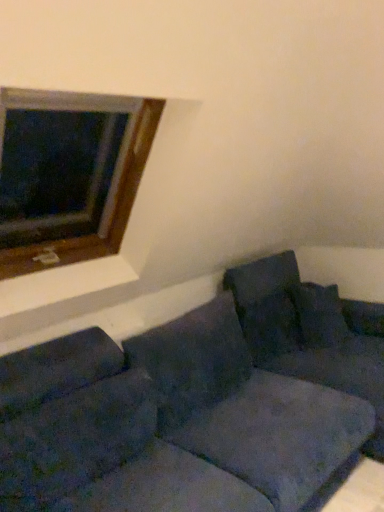
Find the location of a particular element. velvet blue couch at lower right is located at coordinates (190, 409).

This screenshot has height=512, width=384. What do you see at coordinates (266, 304) in the screenshot?
I see `velvety dark blue pillow at center, the second pillow from the right` at bounding box center [266, 304].

Where is `velvety dark blue pillow at center, the third pillow from the right`? velvety dark blue pillow at center, the third pillow from the right is located at coordinates (192, 359).

Is velvet blue couch at lower right at the back of velvety dark blue pillow at center, the first pillow viewed from the left?

Yes, velvety dark blue pillow at center, the first pillow viewed from the left, is facing away from velvet blue couch at lower right.

Who is shorter, velvety dark blue pillow at center, the third pillow from the right, or velvet blue couch at lower right?

velvety dark blue pillow at center, the third pillow from the right.

Measure the distance from velvety dark blue pillow at center, the first pillow viewed from the left, to velvet blue couch at lower right.

velvety dark blue pillow at center, the first pillow viewed from the left, is 6.63 inches from velvet blue couch at lower right.

Considering the positions of objects velvet dark blue pillow at right, which is the 3th pillow from left to right, and wooden frame at upper left in the image provided, who is behind, velvet dark blue pillow at right, which is the 3th pillow from left to right, or wooden frame at upper left?

velvet dark blue pillow at right, which is the 3th pillow from left to right, is behind.

Is point (304, 306) less distant than point (113, 247)?

No, it is behind (113, 247).

From the image's perspective, between velvet dark blue pillow at right, which is the 3th pillow from left to right, and wooden frame at upper left, which one is located above?

wooden frame at upper left is shown above in the image.

From a real-world perspective, between velvet dark blue pillow at right, which ranks as the first pillow in right-to-left order, and wooden frame at upper left, who is vertically lower?

velvet dark blue pillow at right, which ranks as the first pillow in right-to-left order, is physically lower.

Which object is further away from the camera, velvety dark blue pillow at center, the 2th pillow viewed from the left, or velvet blue couch at lower right?

velvety dark blue pillow at center, the 2th pillow viewed from the left, is further away from the camera.

Could you tell me if velvety dark blue pillow at center, the second pillow from the right, is facing velvet blue couch at lower right?

No, velvety dark blue pillow at center, the second pillow from the right, does not turn towards velvet blue couch at lower right.

Does point (287, 279) lie behind point (87, 465)?

Yes, point (287, 279) is behind point (87, 465).

Identify the location of the 2nd pillow behind the velvet blue couch at lower right. This screenshot has width=384, height=512. (266, 304).

From the image's perspective, who appears lower, velvet blue couch at lower right or velvety dark blue pillow at center, the third pillow from the right?

velvet blue couch at lower right appears lower in the image.

Is velvet blue couch at lower right next to velvety dark blue pillow at center, the third pillow from the right, and touching it?

No, velvet blue couch at lower right is not beside velvety dark blue pillow at center, the third pillow from the right.

Is velvet blue couch at lower right positioned beyond the bounds of velvety dark blue pillow at center, the third pillow from the right?

velvet blue couch at lower right is positioned outside velvety dark blue pillow at center, the third pillow from the right.

Looking at their sizes, would you say velvet blue couch at lower right is wider or thinner than velvety dark blue pillow at center, the first pillow viewed from the left?

In the image, velvet blue couch at lower right appears to be wider than velvety dark blue pillow at center, the first pillow viewed from the left.

Considering the positions of objects wooden frame at upper left and velvety dark blue pillow at center, the second pillow from the right, in the image provided, who is more to the left, wooden frame at upper left or velvety dark blue pillow at center, the second pillow from the right,?

wooden frame at upper left.

From a real-world perspective, is wooden frame at upper left physically located above or below velvety dark blue pillow at center, the second pillow from the right?

From a real-world perspective, wooden frame at upper left is physically above velvety dark blue pillow at center, the second pillow from the right.

Are wooden frame at upper left and velvety dark blue pillow at center, the 2th pillow viewed from the left, beside each other?

There is a gap between wooden frame at upper left and velvety dark blue pillow at center, the 2th pillow viewed from the left.

Is wooden frame at upper left spatially inside velvety dark blue pillow at center, the second pillow from the right, or outside of it?

wooden frame at upper left is spatially situated outside velvety dark blue pillow at center, the second pillow from the right.

In the scene shown: Would you consider velvet dark blue pillow at right, which ranks as the first pillow in right-to-left order, to be distant from velvet blue couch at lower right?

No.

Between velvet dark blue pillow at right, which is the 3th pillow from left to right, and velvet blue couch at lower right, which one is positioned in front?

velvet blue couch at lower right is in front.

Considering the relative sizes of velvet dark blue pillow at right, which is the 3th pillow from left to right, and velvet blue couch at lower right in the image provided, is velvet dark blue pillow at right, which is the 3th pillow from left to right, thinner than velvet blue couch at lower right?

Correct, the width of velvet dark blue pillow at right, which is the 3th pillow from left to right, is less than that of velvet blue couch at lower right.

Find the location of `pillow that is the 3rd one when counting backward from the velvet blue couch at lower right`. pillow that is the 3rd one when counting backward from the velvet blue couch at lower right is located at coordinates (319, 315).

Considering the positions of objects wooden frame at upper left and velvet blue couch at lower right in the image provided, who is behind, wooden frame at upper left or velvet blue couch at lower right?

Positioned behind is wooden frame at upper left.

Considering the relative sizes of wooden frame at upper left and velvet blue couch at lower right in the image provided, is wooden frame at upper left shorter than velvet blue couch at lower right?

Incorrect, the height of wooden frame at upper left does not fall short of that of velvet blue couch at lower right.

Measure the distance between wooden frame at upper left and velvet blue couch at lower right.

The distance of wooden frame at upper left from velvet blue couch at lower right is 1.60 meters.

Is point (90, 182) behind point (158, 350)?

Yes, point (90, 182) is farther from viewer.

Find the location of a particular element. The width and height of the screenshot is (384, 512). the 1st pillow positioned above the velvet blue couch at lower right (from the image's perspective) is located at coordinates (192, 359).

The height and width of the screenshot is (512, 384). Identify the location of window lying in front of the velvet dark blue pillow at right, which ranks as the first pillow in right-to-left order. (68, 174).

Estimate the real-world distances between objects in this image. Which object is closer to wooden frame at upper left, velvety dark blue pillow at center, the first pillow viewed from the left, or velvety dark blue pillow at center, the 2th pillow viewed from the left?

Based on the image, velvety dark blue pillow at center, the first pillow viewed from the left, appears to be nearer to wooden frame at upper left.

Based on their spatial positions, is wooden frame at upper left or velvety dark blue pillow at center, the second pillow from the right, closer to velvet blue couch at lower right?

Among the two, velvety dark blue pillow at center, the second pillow from the right, is located nearer to velvet blue couch at lower right.

Considering their positions, is velvet dark blue pillow at right, which ranks as the first pillow in right-to-left order, positioned further to velvety dark blue pillow at center, the third pillow from the right, than wooden frame at upper left?

The object further to velvety dark blue pillow at center, the third pillow from the right, is wooden frame at upper left.

When comparing their distances from velvety dark blue pillow at center, the first pillow viewed from the left, does wooden frame at upper left or velvet blue couch at lower right seem further?

wooden frame at upper left is further to velvety dark blue pillow at center, the first pillow viewed from the left.

Which object lies further to the anchor point wooden frame at upper left, velvety dark blue pillow at center, the 2th pillow viewed from the left, or velvet blue couch at lower right?

velvet blue couch at lower right lies further to wooden frame at upper left than the other object.

Based on their spatial positions, is velvet dark blue pillow at right, which ranks as the first pillow in right-to-left order, or velvety dark blue pillow at center, the first pillow viewed from the left, further from wooden frame at upper left?

Based on the image, velvet dark blue pillow at right, which ranks as the first pillow in right-to-left order, appears to be further to wooden frame at upper left.

Based on their spatial positions, is velvet dark blue pillow at right, which ranks as the first pillow in right-to-left order, or wooden frame at upper left further from velvet blue couch at lower right?

wooden frame at upper left is positioned further to the anchor velvet blue couch at lower right.

When comparing their distances from velvet dark blue pillow at right, which is the 3th pillow from left to right, does velvety dark blue pillow at center, the third pillow from the right, or wooden frame at upper left seem closer?

velvety dark blue pillow at center, the third pillow from the right, is positioned closer to the anchor velvet dark blue pillow at right, which is the 3th pillow from left to right.

Where is `pillow between wooden frame at upper left and velvety dark blue pillow at center, the 2th pillow viewed from the left, in the front-back direction`? The height and width of the screenshot is (512, 384). pillow between wooden frame at upper left and velvety dark blue pillow at center, the 2th pillow viewed from the left, in the front-back direction is located at coordinates (192, 359).

Where is `pillow between velvet blue couch at lower right and velvety dark blue pillow at center, the second pillow from the right, along the z-axis`? pillow between velvet blue couch at lower right and velvety dark blue pillow at center, the second pillow from the right, along the z-axis is located at coordinates (192, 359).

Locate an element on the screen. window between velvet blue couch at lower right and velvet dark blue pillow at right, which is the 3th pillow from left to right, in the front-back direction is located at coordinates (68, 174).

Locate an element on the screen. Image resolution: width=384 pixels, height=512 pixels. window located between velvet blue couch at lower right and velvety dark blue pillow at center, the second pillow from the right, in the depth direction is located at coordinates (68, 174).